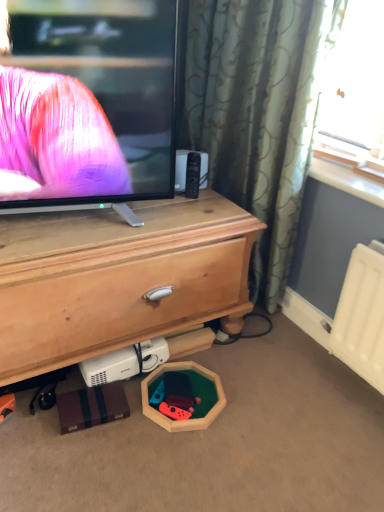
Question: Considering the relative sizes of wooden hexagon at lower center, which ranks as the second toy in left-to-right order, and wooden chest of drawers at center in the image provided, is wooden hexagon at lower center, which ranks as the second toy in left-to-right order, wider than wooden chest of drawers at center?

Choices:
 (A) yes
 (B) no

Answer: (B)

Question: Is wooden hexagon at lower center, acting as the 1th toy starting from the right, oriented away from wooden chest of drawers at center?

Choices:
 (A) no
 (B) yes

Answer: (B)

Question: From a real-world perspective, is wooden hexagon at lower center, which ranks as the second toy in left-to-right order, on wooden chest of drawers at center?

Choices:
 (A) no
 (B) yes

Answer: (A)

Question: Are wooden hexagon at lower center, which ranks as the second toy in left-to-right order, and wooden chest of drawers at center far apart?

Choices:
 (A) yes
 (B) no

Answer: (B)

Question: From the image's perspective, would you say wooden hexagon at lower center, acting as the 1th toy starting from the right, is shown under wooden chest of drawers at center?

Choices:
 (A) no
 (B) yes

Answer: (B)

Question: From the image's perspective, is wooden chest of drawers at center positioned above or below wooden hexagon at lower center, the 1th toy viewed from the left?

Choices:
 (A) above
 (B) below

Answer: (A)

Question: Which is correct: wooden chest of drawers at center is inside wooden hexagon at lower center, the second toy when ordered from right to left, or outside of it?

Choices:
 (A) inside
 (B) outside

Answer: (B)

Question: In the image, is wooden chest of drawers at center on the left side or the right side of wooden hexagon at lower center, the second toy when ordered from right to left?

Choices:
 (A) left
 (B) right

Answer: (A)

Question: From a real-world perspective, relative to wooden hexagon at lower center, the second toy when ordered from right to left, is wooden chest of drawers at center vertically above or below?

Choices:
 (A) below
 (B) above

Answer: (B)

Question: In terms of width, does wooden chest of drawers at center look wider or thinner when compared to wooden hexagon at lower center, which ranks as the second toy in left-to-right order?

Choices:
 (A) thin
 (B) wide

Answer: (B)

Question: Considering the positions of point (200, 276) and point (223, 403), is point (200, 276) closer or farther from the camera than point (223, 403)?

Choices:
 (A) closer
 (B) farther

Answer: (B)

Question: Is wooden chest of drawers at center inside or outside of wooden hexagon at lower center, which ranks as the second toy in left-to-right order?

Choices:
 (A) outside
 (B) inside

Answer: (A)

Question: In terms of height, does wooden chest of drawers at center look taller or shorter compared to wooden hexagon at lower center, acting as the 1th toy starting from the right?

Choices:
 (A) tall
 (B) short

Answer: (A)

Question: From a real-world perspective, is wooden hexagon at lower center, which ranks as the second toy in left-to-right order, physically located above or below wooden hexagon at lower center, the 1th toy viewed from the left?

Choices:
 (A) above
 (B) below

Answer: (B)

Question: In the image, is wooden hexagon at lower center, which ranks as the second toy in left-to-right order, positioned in front of or behind wooden hexagon at lower center, the second toy when ordered from right to left?

Choices:
 (A) behind
 (B) front

Answer: (B)